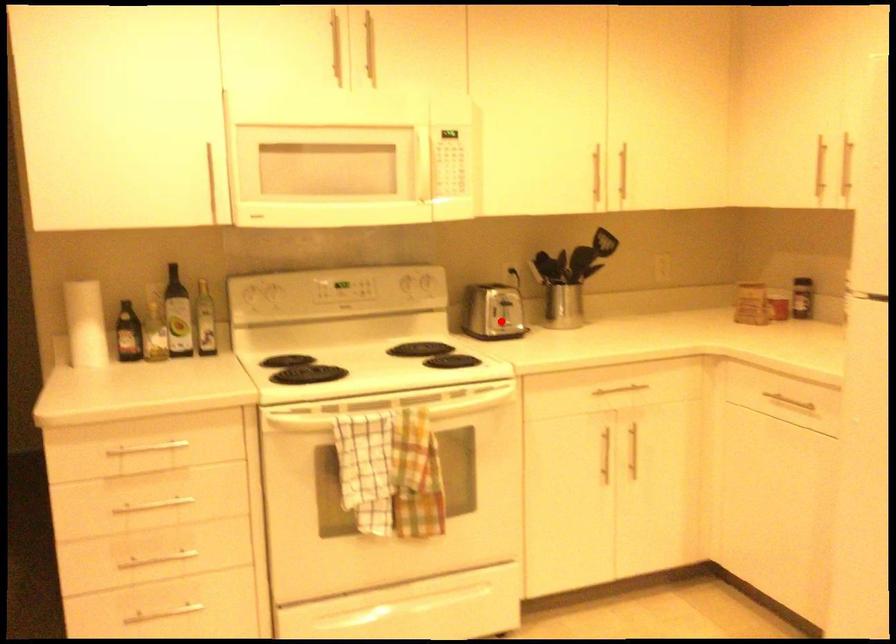
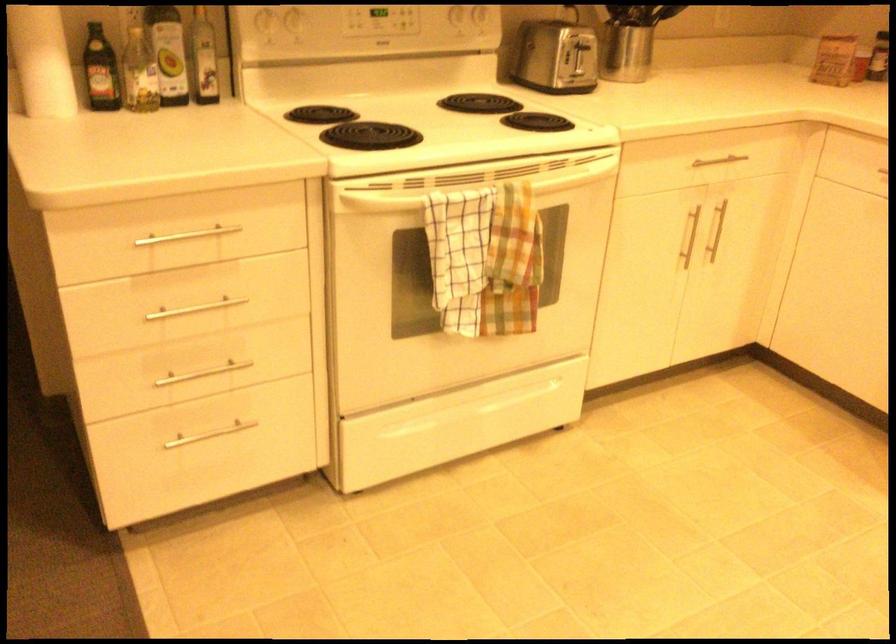
Find the pixel in the second image that matches the highlighted location in the first image.

(572, 73)